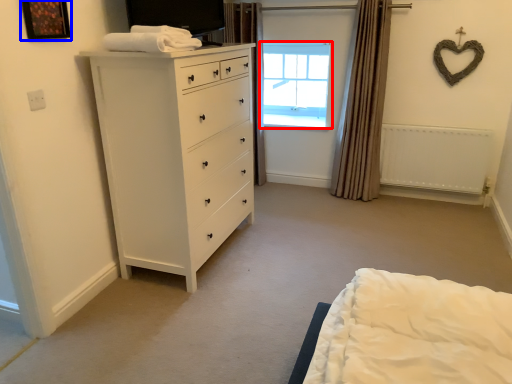
Question: Which object is closer to the camera taking this photo, window (highlighted by a red box) or picture frame (highlighted by a blue box)?

Choices:
 (A) window
 (B) picture frame

Answer: (B)